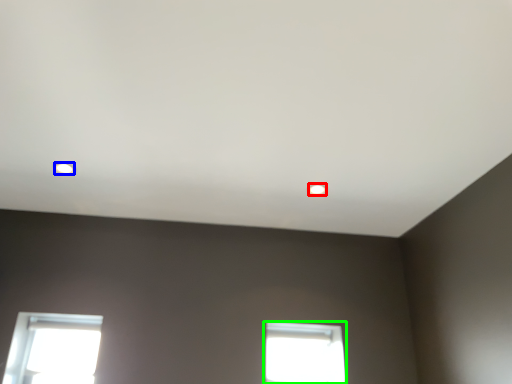
Question: Estimate the real-world distances between objects in this image. Which object is farther from lighting (highlighted by a red box), lighting (highlighted by a blue box) or window (highlighted by a green box)?

Choices:
 (A) lighting
 (B) window

Answer: (A)